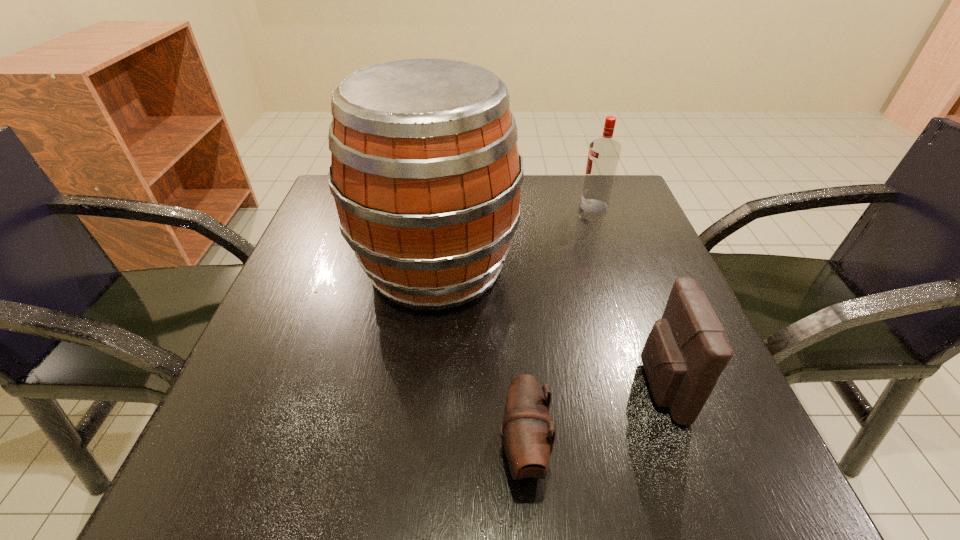
Where is `vacant area that lies between the second shortest object and the tallest object`? Image resolution: width=960 pixels, height=540 pixels. vacant area that lies between the second shortest object and the tallest object is located at coordinates (548, 327).

Select which object is the closest to the farthest object. Please provide its 2D coordinates. Your answer should be formatted as a tuple, i.e. [(x, y)], where the tuple contains the x and y coordinates of a point satisfying the conditions above.

[(425, 171)]

This screenshot has height=540, width=960. What are the coordinates of `the third closest object to the second tallest object` in the screenshot? It's located at (528, 441).

This screenshot has width=960, height=540. In order to click on vacant area in the image that satisfies the following two spatial constraints: 1. on the front label of the third shortest object; 2. on the front side of the cider in this screenshot , I will do `click(614, 267)`.